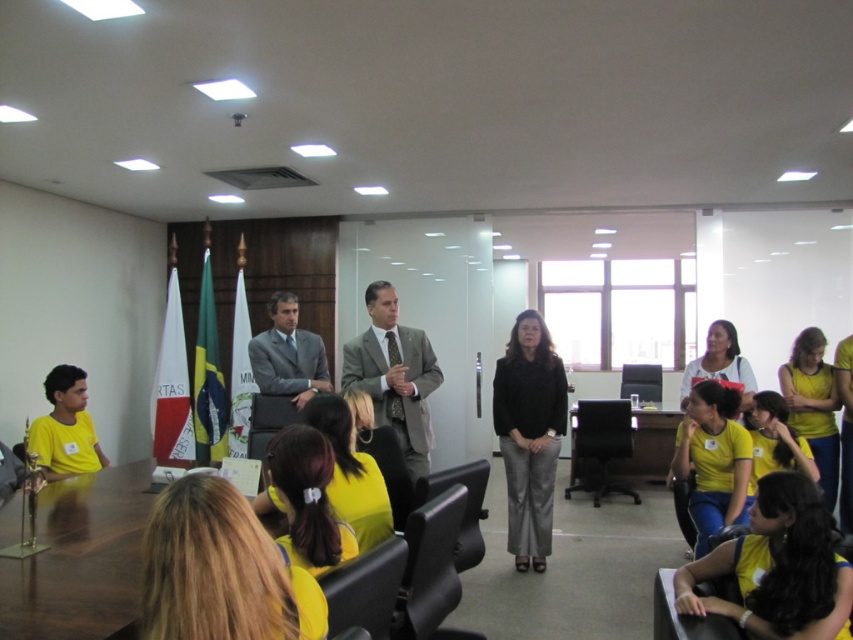
Question: Among these points, which one is farthest from the camera?

Choices:
 (A) (206, 534)
 (B) (392, 392)
 (C) (718, 460)

Answer: (C)

Question: Is blonde hair at lower center thinner than yellow fabric shirt at lower right?

Choices:
 (A) no
 (B) yes

Answer: (B)

Question: Does brown wood table at center have a smaller size compared to yellow shirt at right?

Choices:
 (A) yes
 (B) no

Answer: (A)

Question: Can you confirm if yellow shirt at lower right is smaller than yellow shirt at right?

Choices:
 (A) yes
 (B) no

Answer: (A)

Question: Which of the following is the farthest from the observer?

Choices:
 (A) (778, 516)
 (B) (325, 362)
 (C) (61, 416)
 (D) (354, 355)

Answer: (B)

Question: Among these objects, which one is farthest from the camera?

Choices:
 (A) blonde hair at lower center
 (B) yellow shirt at right
 (C) black matte pants at center

Answer: (C)